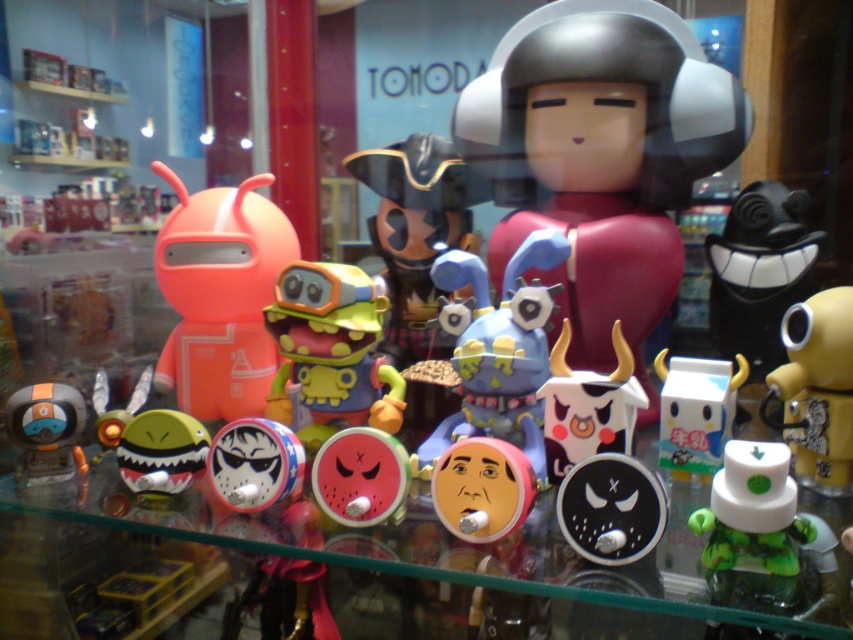
You are a customer looking at the store window and see two points marked in the display. The first point is at coordinates point (772, 548) and the second is at point (715, 378). Which point is closer to you?

Point (772, 548) is closer to the viewer than point (715, 378).

You are a customer in the store and want to choose a toy that is wider. Which one between the green matte toy at lower right and the black matte toy at right should you pick?

The black matte toy at right is wider than the green matte toy at lower right, so you should pick the black matte toy at right.

You are a customer in a toy store standing 3 feet away from the display case. You want to pick up the green matte toy at lower right. Can you reach it without moving closer?

The green matte toy at lower right is 28.61 inches from the camera. Since you are standing 3 feet away, which is 36 inches, the toy is within your reach. You can pick it up without moving closer.